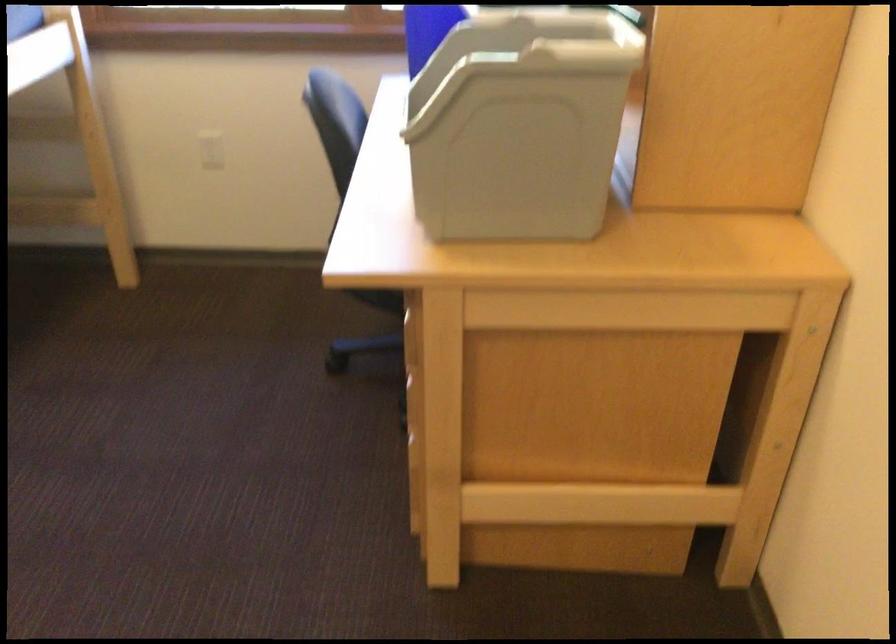
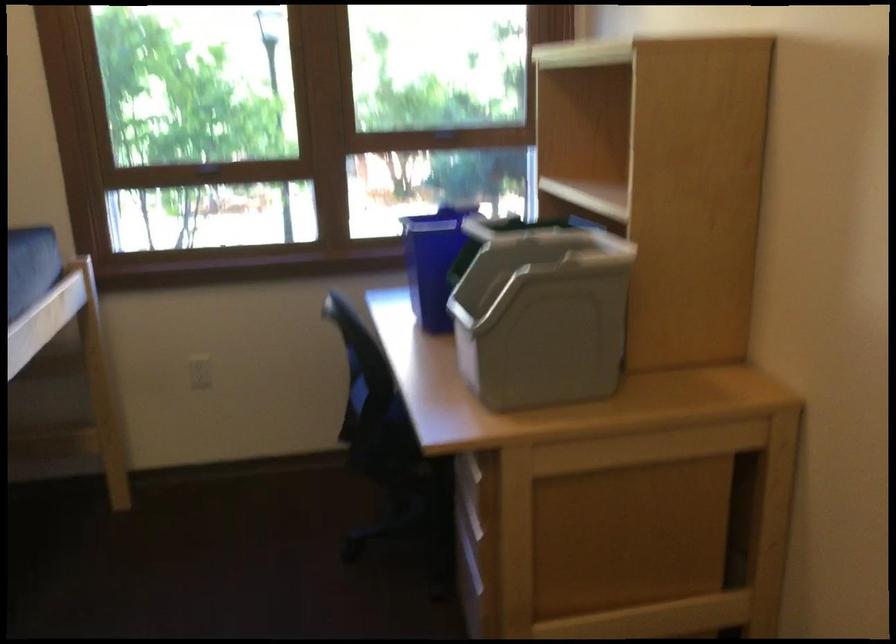
Find the pixel in the second image that matches (209,154) in the first image.

(200, 372)